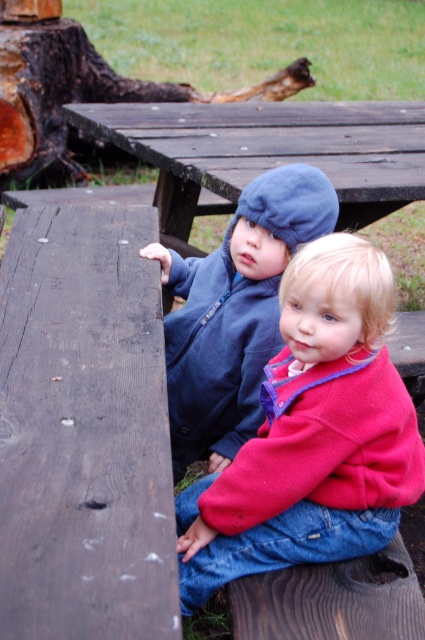
Looking at this image, is dark brown wooden picnic table at center positioned behind blue fleece jacket at center?

Yes, dark brown wooden picnic table at center is further from the viewer.

This screenshot has height=640, width=425. What do you see at coordinates (269, 148) in the screenshot?
I see `dark brown wooden picnic table at center` at bounding box center [269, 148].

The image size is (425, 640). Identify the location of dark brown wooden picnic table at center. (269, 148).

Can you confirm if blue fleece jacket at center is bigger than charred wood log at upper center?

Actually, blue fleece jacket at center might be smaller than charred wood log at upper center.

Does blue fleece jacket at center appear under charred wood log at upper center?

Indeed, blue fleece jacket at center is positioned under charred wood log at upper center.

Does point (187, 445) come in front of point (167, 92)?

Yes, point (187, 445) is closer to viewer.

The width and height of the screenshot is (425, 640). I want to click on blue fleece jacket at center, so click(x=234, y=312).

Is dark brown wooden picnic table at center bigger than charred wood log at upper center?

Actually, dark brown wooden picnic table at center might be smaller than charred wood log at upper center.

The image size is (425, 640). I want to click on dark brown wooden picnic table at center, so click(269, 148).

The image size is (425, 640). Find the location of `dark brown wooden picnic table at center`. dark brown wooden picnic table at center is located at coordinates (269, 148).